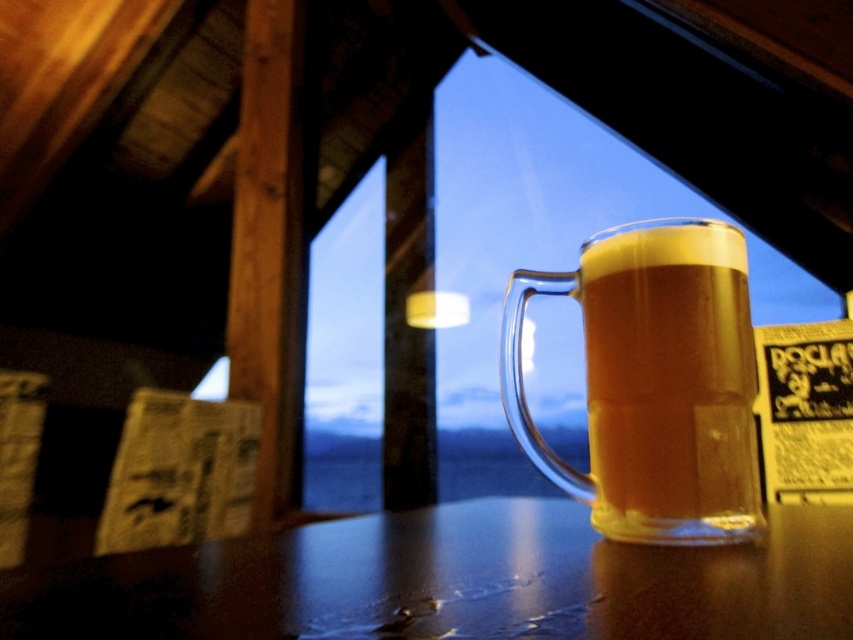
Question: Does shiny brown table at center have a smaller size compared to translucent glass mug at center?

Choices:
 (A) yes
 (B) no

Answer: (B)

Question: Does shiny brown table at center lie in front of translucent glass mug at center?

Choices:
 (A) yes
 (B) no

Answer: (A)

Question: Does shiny brown table at center have a larger size compared to translucent glass mug at center?

Choices:
 (A) no
 (B) yes

Answer: (B)

Question: Which point appears closest to the camera in this image?

Choices:
 (A) (599, 422)
 (B) (178, 561)

Answer: (B)